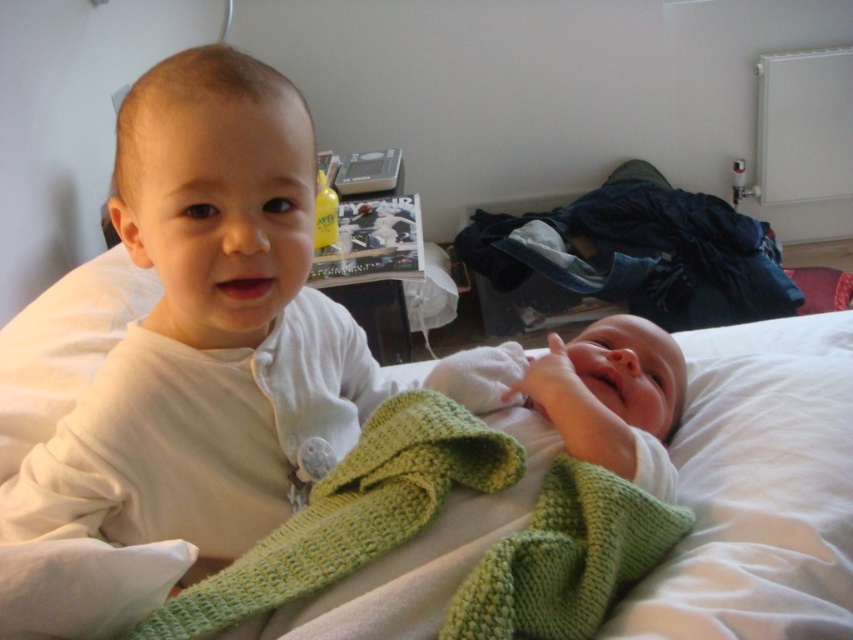
Does white soft bed at center appear on the right side of white knit fabric at center?

Indeed, white soft bed at center is positioned on the right side of white knit fabric at center.

Does white soft bed at center have a larger size compared to white knit fabric at center?

Indeed, white soft bed at center has a larger size compared to white knit fabric at center.

Which is behind, point (763, 406) or point (669, 422)?

The point (763, 406) is more distant.

Where is `white soft bed at center`? Image resolution: width=853 pixels, height=640 pixels. white soft bed at center is located at coordinates (767, 493).

Does white matte baby at upper left appear over white knit fabric at center?

Indeed, white matte baby at upper left is positioned over white knit fabric at center.

Is point (83, 403) farther from camera compared to point (621, 403)?

That is False.

This screenshot has height=640, width=853. Identify the location of white matte baby at upper left. (206, 326).

The height and width of the screenshot is (640, 853). What do you see at coordinates (767, 493) in the screenshot?
I see `white soft bed at center` at bounding box center [767, 493].

Between white soft bed at center and green knitted blanket at center, which one has less height?

With less height is green knitted blanket at center.

Is point (38, 328) in front of point (206, 588)?

No, it is behind (206, 588).

Where is `white soft bed at center`? white soft bed at center is located at coordinates (767, 493).